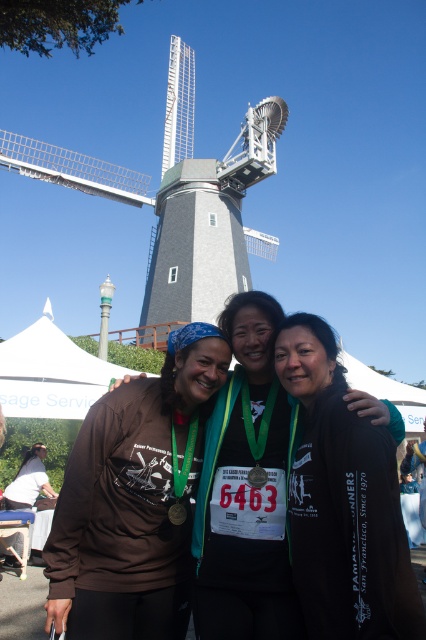
Question: Is black matte jacket at center smaller than matte black shirt at center?

Choices:
 (A) yes
 (B) no

Answer: (A)

Question: Does matte brown shirt at center have a greater width compared to black matte jacket at center?

Choices:
 (A) yes
 (B) no

Answer: (A)

Question: Does black matte jacket at center have a lesser width compared to gray wood windmill at upper center?

Choices:
 (A) no
 (B) yes

Answer: (B)

Question: Which of the following is the farthest from the observer?

Choices:
 (A) matte brown shirt at center
 (B) black matte jacket at center
 (C) matte black shirt at center

Answer: (C)

Question: Which point is farther from the camera taking this photo?

Choices:
 (A) (178, 564)
 (B) (276, 604)
 (C) (152, 272)
 (D) (301, 349)

Answer: (C)

Question: Which of the following is the closest to the observer?

Choices:
 (A) (178, 448)
 (B) (170, 76)
 (C) (193, 600)

Answer: (C)